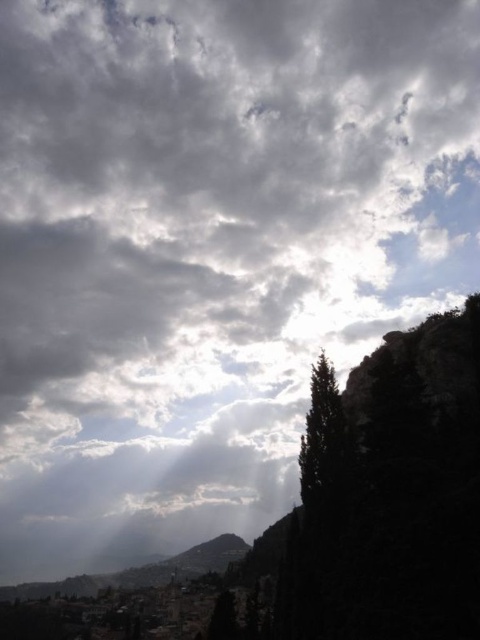
Question: Which point is closer to the camera?

Choices:
 (A) green matte tree at center-right
 (B) rugged stone mountain at lower center

Answer: (A)

Question: Does green matte tree at center-right appear over rugged stone mountain at lower center?

Choices:
 (A) yes
 (B) no

Answer: (A)

Question: Which point is farther to the camera?

Choices:
 (A) (324, 460)
 (B) (243, 547)

Answer: (B)

Question: Does green matte tree at center-right have a greater width compared to rugged stone mountain at lower center?

Choices:
 (A) no
 (B) yes

Answer: (A)

Question: Is green matte tree at center-right to the right of rugged stone mountain at lower center from the viewer's perspective?

Choices:
 (A) no
 (B) yes

Answer: (B)